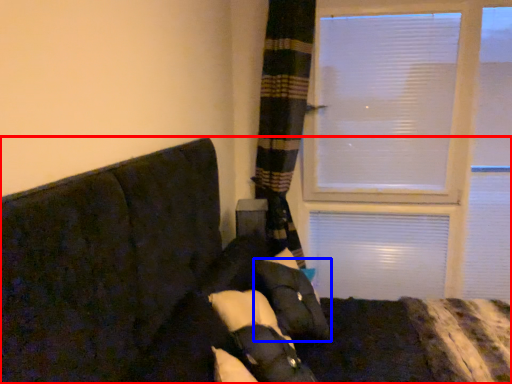
Question: Which object is closer to the camera taking this photo, furniture (highlighted by a red box) or pillow (highlighted by a blue box)?

Choices:
 (A) furniture
 (B) pillow

Answer: (A)